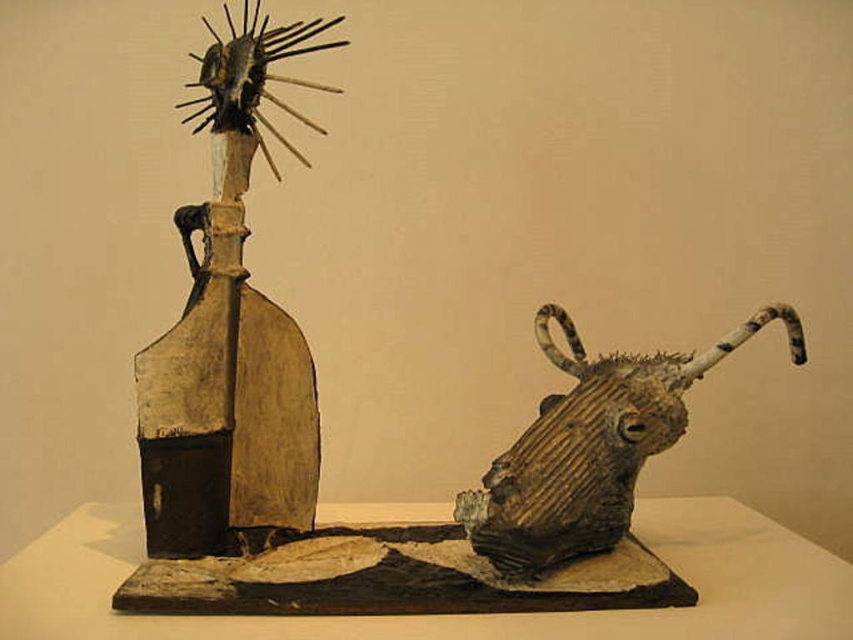
Please provide the 2D coordinates of the wooden bottle at left in the image.

The wooden bottle at left is located at coordinates [229,339].

From the picture: What object is located at the coordinates point (229, 339) in the image?

The point (229, 339) corresponds to the wooden bottle at left.

You are an art installer who needs to place a new sculpture between the wooden bottle at left and the rustic wood bull head at right. The new sculpture is 25 centimeters wide. Will there be enough space between them to fit the new sculpture?

The distance between the wooden bottle at left and rustic wood bull head at right is 26.46 centimeters. Since the new sculpture is 25 centimeters wide, there is enough space to fit it between them with approximately 1.46 centimeters of clearance.